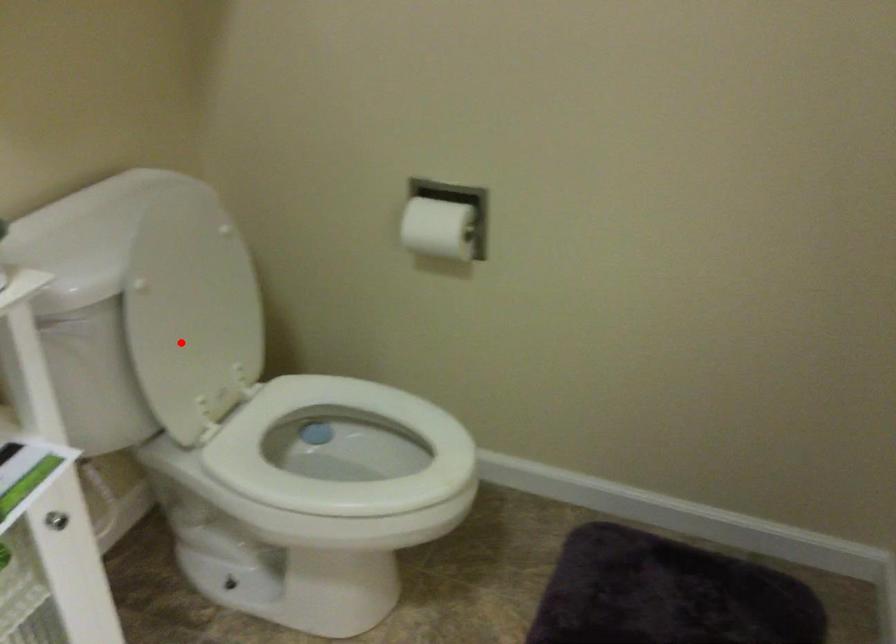
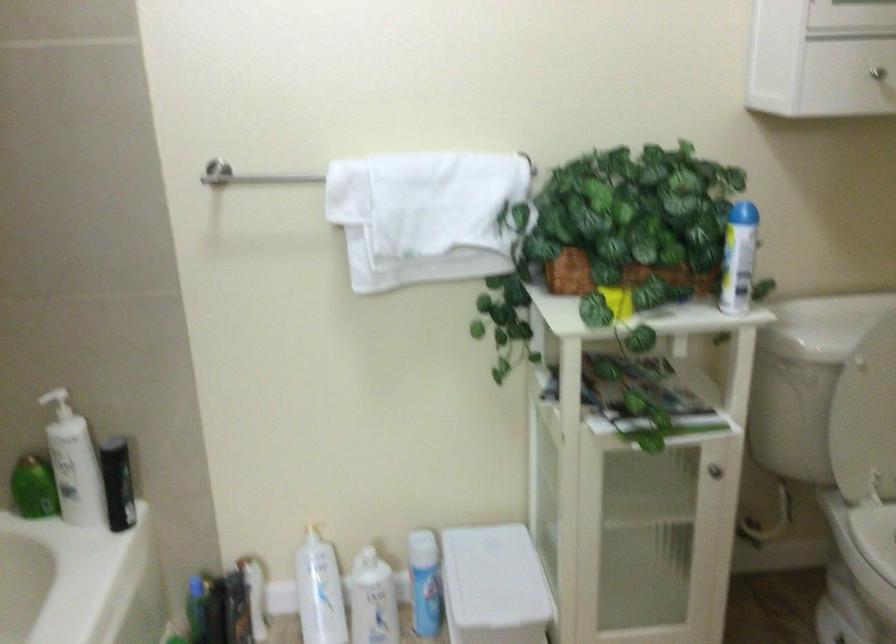
Locate, in the second image, the point that corresponds to the highlighted location in the first image.

(865, 413)